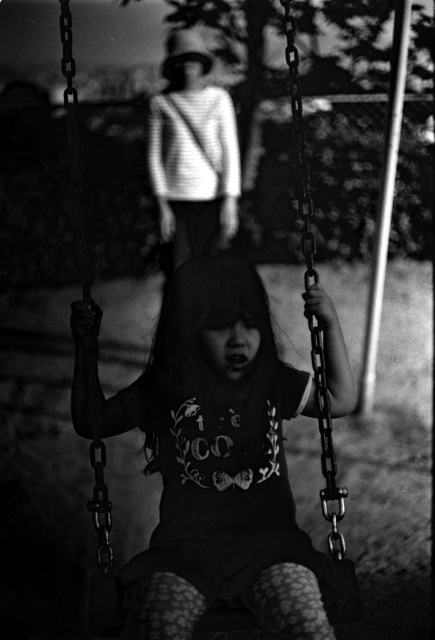
Does dark fabric shirt at center appear over striped sweater at upper center?

Incorrect, dark fabric shirt at center is not positioned above striped sweater at upper center.

Image resolution: width=435 pixels, height=640 pixels. What do you see at coordinates (210, 452) in the screenshot? I see `dark fabric shirt at center` at bounding box center [210, 452].

Where is `dark fabric shirt at center`? dark fabric shirt at center is located at coordinates (210, 452).